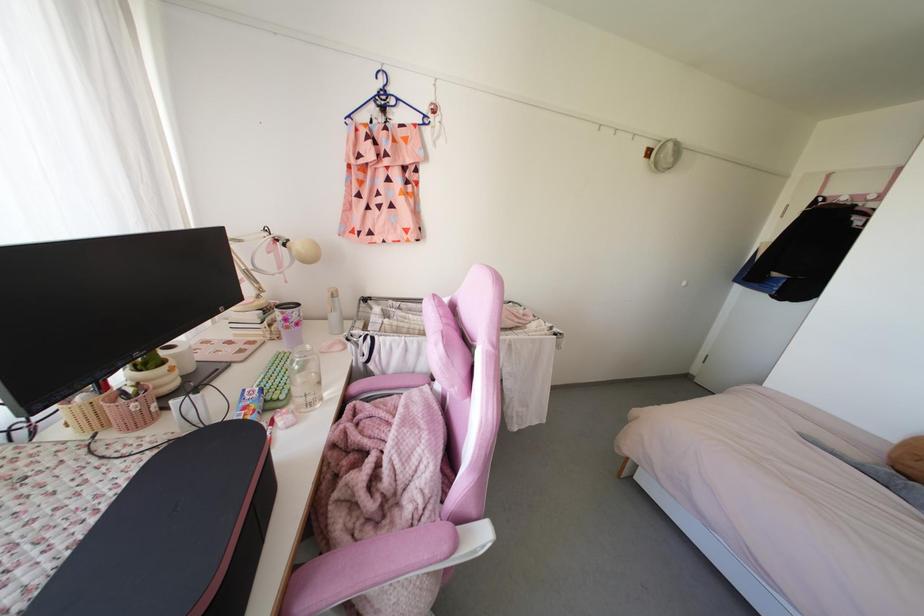
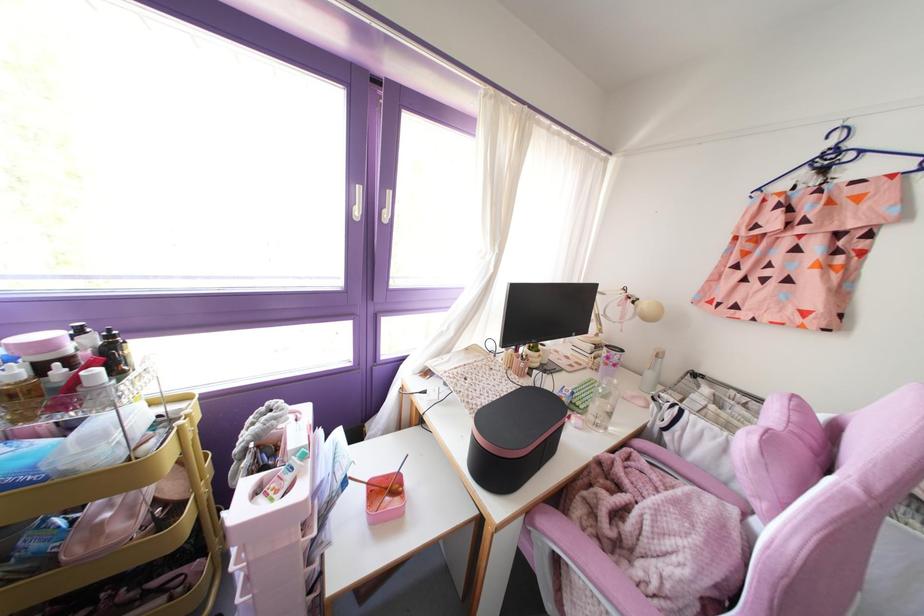
Where in the second image is the point corresponding to point (257, 282) from the first image?

(600, 325)